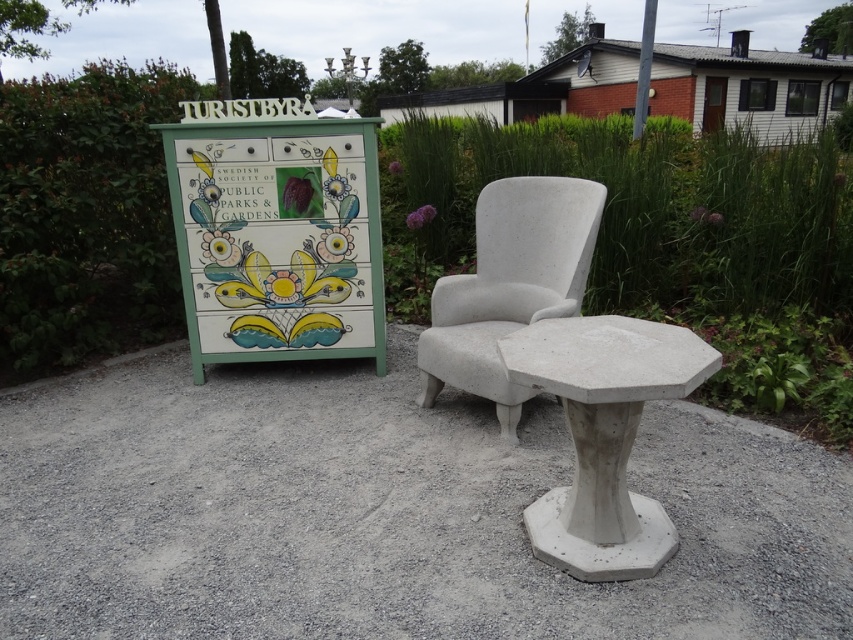
Question: Can you confirm if gray concrete table at center is positioned below concrete/stone stool at center?

Choices:
 (A) no
 (B) yes

Answer: (B)

Question: Which point is farther to the camera?

Choices:
 (A) white concrete chair at center
 (B) green textured hedge at left
 (C) gray concrete table at center
 (D) concrete/stone stool at center

Answer: (B)

Question: Among these points, which one is farthest from the camera?

Choices:
 (A) (457, 508)
 (B) (291, 352)
 (C) (587, 397)

Answer: (B)

Question: Which object is closer to the camera taking this photo?

Choices:
 (A) concrete/stone stool at center
 (B) gray concrete table at center
 (C) white concrete chair at center
 (D) painted wood signboard at left

Answer: (A)

Question: Can you confirm if green textured hedge at left is smaller than white concrete chair at center?

Choices:
 (A) yes
 (B) no

Answer: (B)

Question: Considering the relative positions of gray concrete table at center and painted wood signboard at left in the image provided, where is gray concrete table at center located with respect to painted wood signboard at left?

Choices:
 (A) above
 (B) below

Answer: (B)